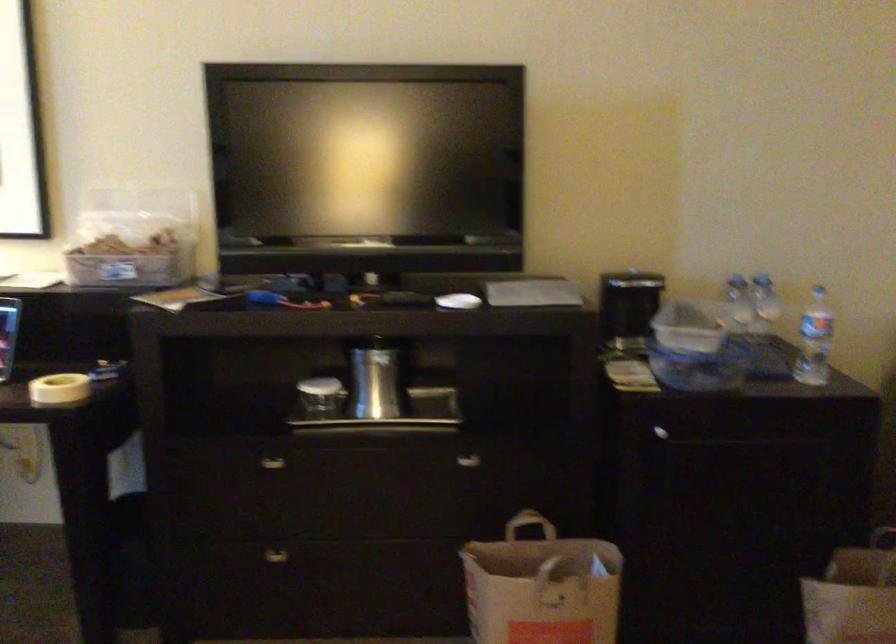
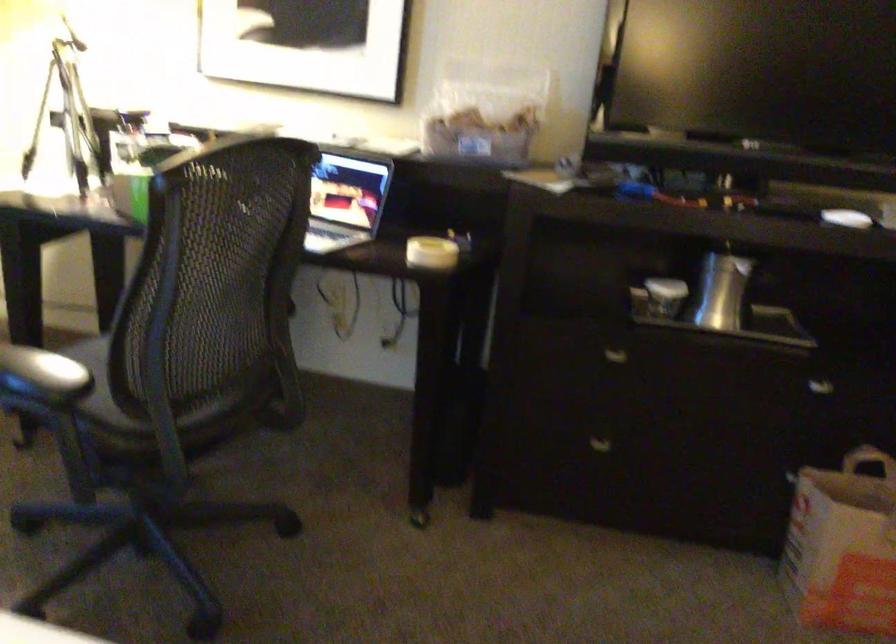
Question: The camera is either moving clockwise (left) or counter-clockwise (right) around the object. The first image is from the beginning of the video and the second image is from the end. Is the camera moving left or right when shooting the video?

Choices:
 (A) Left
 (B) Right

Answer: (B)